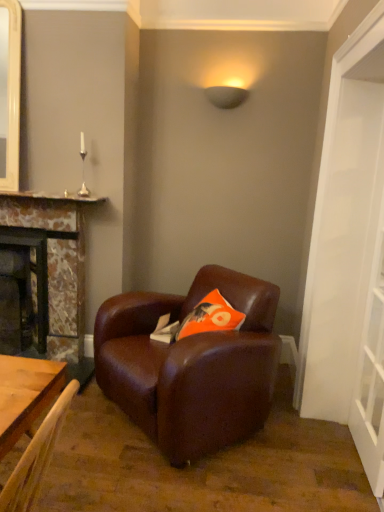
Question: Can you confirm if orange fabric pillow at center is positioned to the right of transparent glass door at right?

Choices:
 (A) yes
 (B) no

Answer: (B)

Question: From a real-world perspective, is orange fabric pillow at center physically below transparent glass door at right?

Choices:
 (A) yes
 (B) no

Answer: (A)

Question: Is orange fabric pillow at center not near transparent glass door at right?

Choices:
 (A) yes
 (B) no

Answer: (B)

Question: From the image's perspective, is orange fabric pillow at center on top of transparent glass door at right?

Choices:
 (A) yes
 (B) no

Answer: (B)

Question: Is orange fabric pillow at center at the left side of transparent glass door at right?

Choices:
 (A) yes
 (B) no

Answer: (A)

Question: Is orange fabric pillow at center outside transparent glass door at right?

Choices:
 (A) yes
 (B) no

Answer: (A)

Question: Does matte black lampshade at upper center have a smaller size compared to matte stone fireplace at left, acting as the 2th fireplace starting from the right?

Choices:
 (A) no
 (B) yes

Answer: (B)

Question: Considering the relative positions of matte black lampshade at upper center and matte stone fireplace at left, which appears as the first fireplace when viewed from the left, in the image provided, is matte black lampshade at upper center to the right of matte stone fireplace at left, which appears as the first fireplace when viewed from the left, from the viewer's perspective?

Choices:
 (A) yes
 (B) no

Answer: (A)

Question: From a real-world perspective, is matte black lampshade at upper center positioned under matte stone fireplace at left, acting as the 2th fireplace starting from the right, based on gravity?

Choices:
 (A) yes
 (B) no

Answer: (B)

Question: Is matte black lampshade at upper center outside of matte stone fireplace at left, which appears as the first fireplace when viewed from the left?

Choices:
 (A) no
 (B) yes

Answer: (B)

Question: Could you tell me if matte black lampshade at upper center is facing matte stone fireplace at left, which appears as the first fireplace when viewed from the left?

Choices:
 (A) yes
 (B) no

Answer: (B)

Question: Considering the relative sizes of matte black lampshade at upper center and matte stone fireplace at left, acting as the 2th fireplace starting from the right, in the image provided, is matte black lampshade at upper center thinner than matte stone fireplace at left, acting as the 2th fireplace starting from the right,?

Choices:
 (A) no
 (B) yes

Answer: (B)

Question: From a real-world perspective, is transparent glass door at right physically below matte black lampshade at upper center?

Choices:
 (A) yes
 (B) no

Answer: (A)